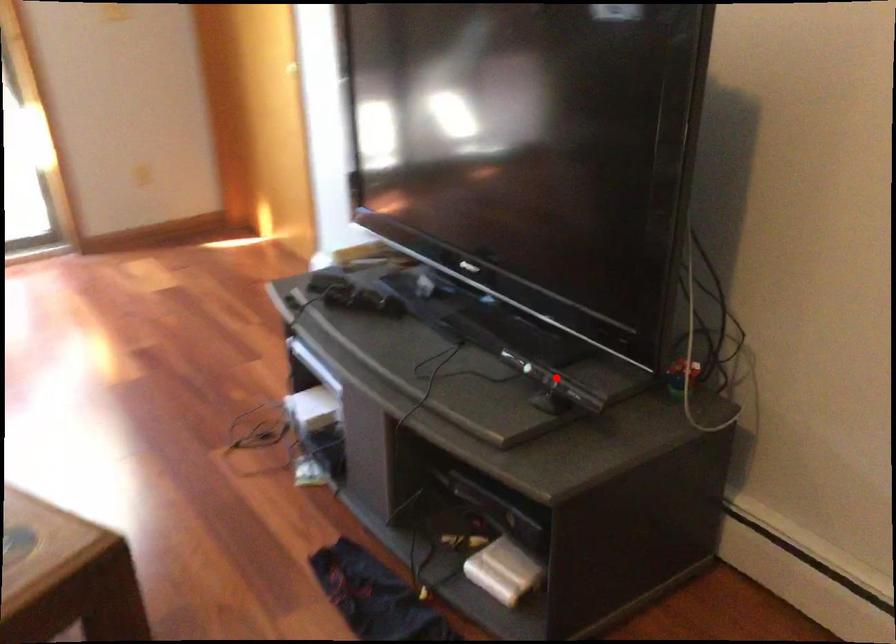
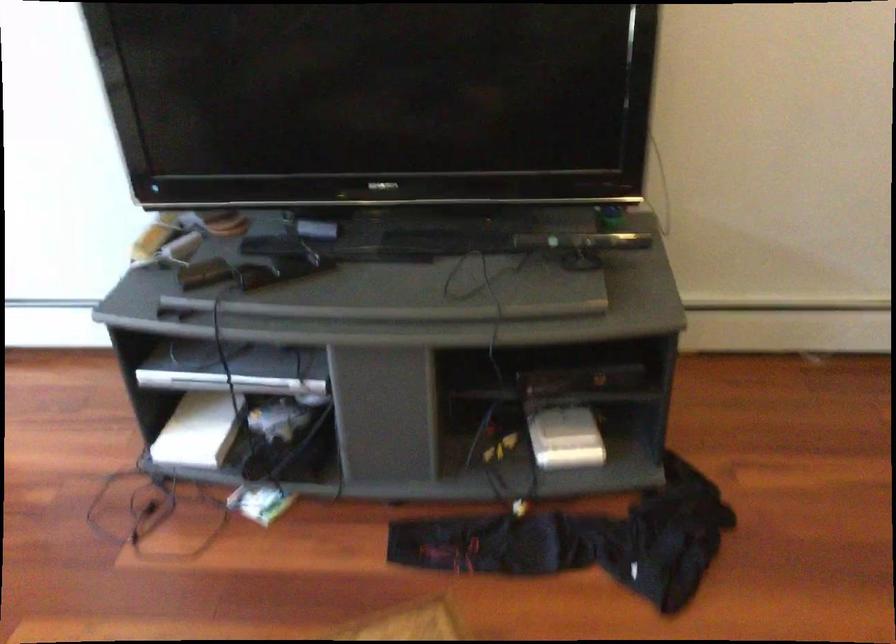
In the second image, find the point that corresponds to the highlighted location in the first image.

(582, 241)